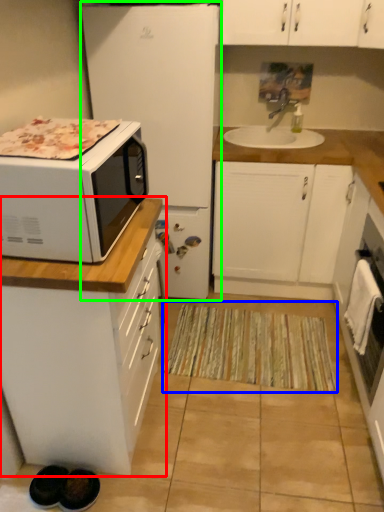
Question: Which is farther away from cabinetry (highlighted by a red box)? doormat (highlighted by a blue box) or refrigerator (highlighted by a green box)?

Choices:
 (A) doormat
 (B) refrigerator

Answer: (B)